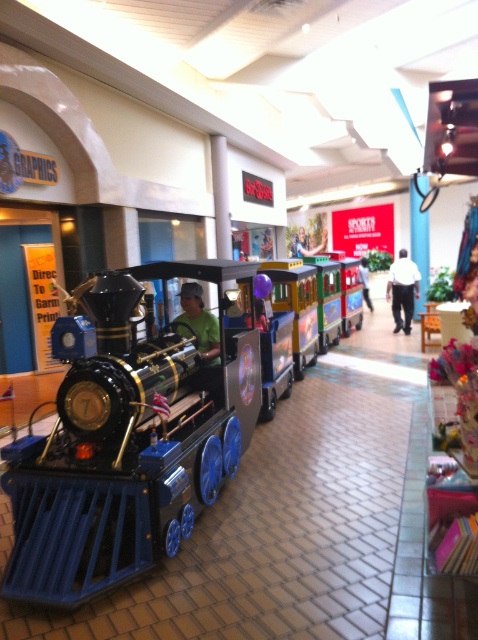
Is point (400, 316) closer to viewer compared to point (358, 268)?

Yes, point (400, 316) is closer to viewer.

Does white fabric pants at center have a smaller size compared to matte green shirt at center?

Actually, white fabric pants at center might be larger than matte green shirt at center.

I want to click on white fabric pants at center, so click(402, 289).

Image resolution: width=478 pixels, height=640 pixels. Describe the element at coordinates (130, 442) in the screenshot. I see `shiny black locomotive at left` at that location.

Is point (239, 352) closer to viewer compared to point (306, 248)?

Yes, point (239, 352) is in front of point (306, 248).

Between point (207, 440) and point (308, 250), which one is positioned in front?

Point (207, 440) is in front.

Find the location of a particular element. shiny black locomotive at left is located at coordinates (130, 442).

Which is in front, point (208, 328) or point (368, 262)?

Point (208, 328)

Can you confirm if green matte shirt at center is wider than matte green shirt at center?

Yes.

Is point (209, 314) positioned in front of point (365, 276)?

That is True.

The image size is (478, 640). I want to click on green matte shirt at center, so click(199, 321).